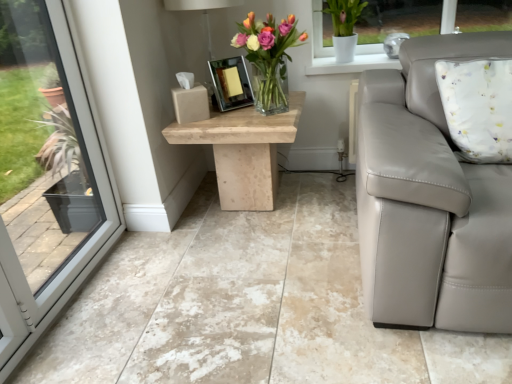
Question: Does matte white lamp at upper center turn towards beige marble floor at center?

Choices:
 (A) yes
 (B) no

Answer: (B)

Question: Are matte white lamp at upper center and beige marble floor at center beside each other?

Choices:
 (A) no
 (B) yes

Answer: (A)

Question: Is matte white lamp at upper center far from beige marble floor at center?

Choices:
 (A) no
 (B) yes

Answer: (B)

Question: From the image's perspective, is matte white lamp at upper center beneath beige marble floor at center?

Choices:
 (A) yes
 (B) no

Answer: (B)

Question: Is matte white lamp at upper center shorter than beige marble floor at center?

Choices:
 (A) yes
 (B) no

Answer: (B)

Question: Is matte white lamp at upper center located outside beige marble floor at center?

Choices:
 (A) yes
 (B) no

Answer: (A)

Question: Does beige marble floor at center have a larger size compared to translucent glass vase at center?

Choices:
 (A) yes
 (B) no

Answer: (A)

Question: From the image's perspective, is beige marble floor at center located above translucent glass vase at center?

Choices:
 (A) no
 (B) yes

Answer: (A)

Question: Is beige marble floor at center shorter than translucent glass vase at center?

Choices:
 (A) no
 (B) yes

Answer: (B)

Question: Is beige marble floor at center not close to translucent glass vase at center?

Choices:
 (A) no
 (B) yes

Answer: (A)

Question: Is beige marble floor at center at the left side of translucent glass vase at center?

Choices:
 (A) no
 (B) yes

Answer: (B)

Question: Is beige marble floor at center at the right side of translucent glass vase at center?

Choices:
 (A) yes
 (B) no

Answer: (B)

Question: Considering the relative sizes of matte white lamp at upper center and translucent glass vase at center in the image provided, is matte white lamp at upper center taller than translucent glass vase at center?

Choices:
 (A) yes
 (B) no

Answer: (A)